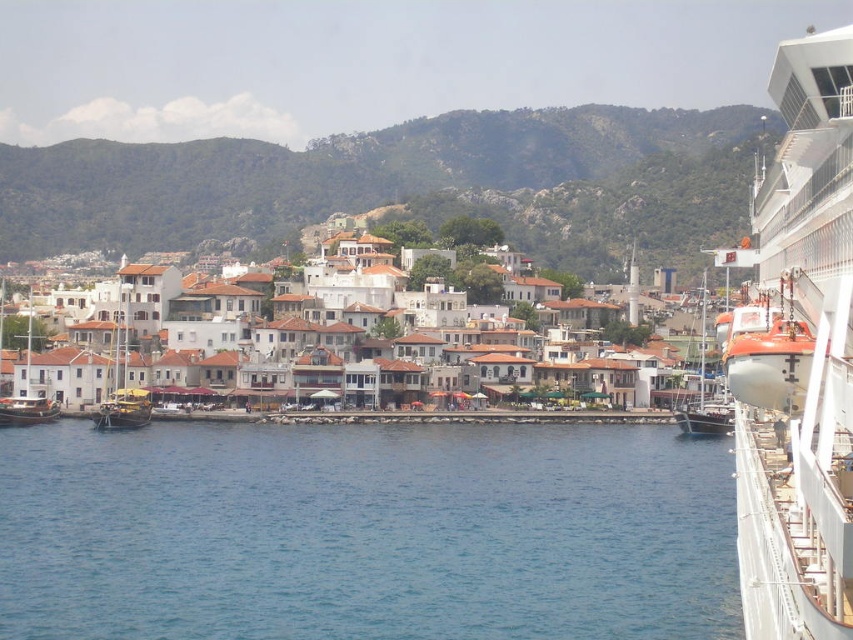
You are standing on the deck of the cruise ship and want to locate the white glossy lifeboat at right. According to the coordinates provided, where should you look relative to your current position?

The white glossy lifeboat at right is located at point coordinates 0.561 on the x axis and 0.938 on the y axis. Since the coordinates are relative to the image frame, you should look towards the right side of the scene, closer to the bottom edge to find it.

You are a photographer standing on the deck of the cruise ship. You want to capture both the white glossy lifeboat at right and the wooden sailboat at center in your photo. Which object will appear larger in the photo?

The white glossy lifeboat at right will appear larger in the photo because it is much taller than the wooden sailboat at center.

Based on the photo, you are standing on the deck of the cruise ship and see two points marked in the scene. Which point is closer to you, point (741,497) or point (706,273)?

Point (741,497) is in front of point (706,273), so it is closer to you.